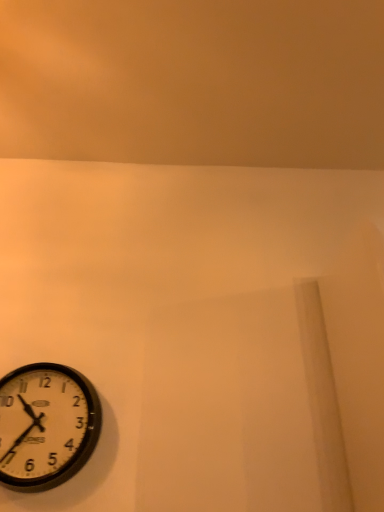
Locate an element on the screen. The width and height of the screenshot is (384, 512). white plastic clock at lower left is located at coordinates (46, 426).

Describe the element at coordinates (46, 426) in the screenshot. I see `white plastic clock at lower left` at that location.

Where is `white plastic clock at lower left`? The height and width of the screenshot is (512, 384). white plastic clock at lower left is located at coordinates (46, 426).